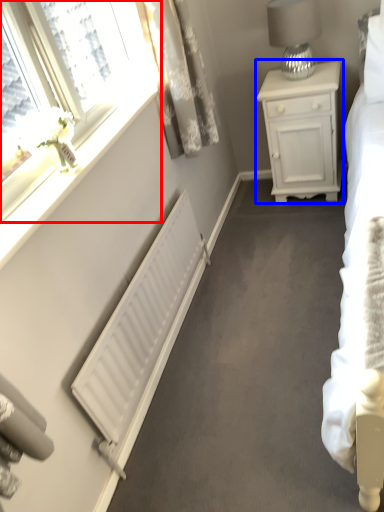
Question: Which object appears farthest to the camera in this image, window (highlighted by a red box) or nightstand (highlighted by a blue box)?

Choices:
 (A) window
 (B) nightstand

Answer: (B)